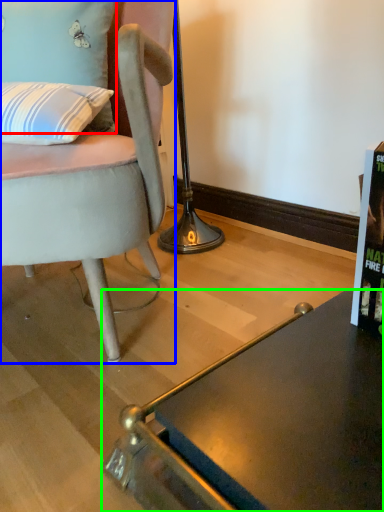
Question: Considering the real-world distances, which object is farthest from pillow (highlighted by a red box)? chair (highlighted by a blue box) or desk (highlighted by a green box)?

Choices:
 (A) chair
 (B) desk

Answer: (B)